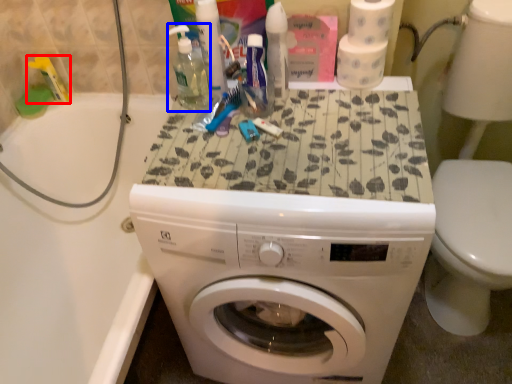
Question: Among these objects, which one is farthest to the camera, toiletry (highlighted by a red box) or cleaning product (highlighted by a blue box)?

Choices:
 (A) toiletry
 (B) cleaning product

Answer: (A)